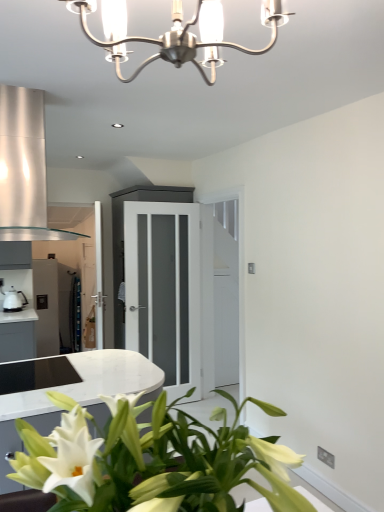
The height and width of the screenshot is (512, 384). What do you see at coordinates (152, 460) in the screenshot? I see `white glossy houseplant at lower left` at bounding box center [152, 460].

Identify the location of white glossy houseplant at lower left. The height and width of the screenshot is (512, 384). (152, 460).

What do you see at coordinates (164, 289) in the screenshot?
I see `white frosted glass door at center` at bounding box center [164, 289].

Identify the location of white glossy houseplant at lower left. The width and height of the screenshot is (384, 512). (152, 460).

From the picture: Who is bigger, white glossy kettle at left or white glossy houseplant at lower left?

With larger size is white glossy houseplant at lower left.

From the image's perspective, which is above, white glossy kettle at left or white glossy houseplant at lower left?

white glossy kettle at left, from the image's perspective.

Is the position of white glossy kettle at left less distant than that of white glossy houseplant at lower left?

No, white glossy kettle at left is further to the viewer.

Considering the relative sizes of white frosted glass door at center and white glossy kettle at left in the image provided, is white frosted glass door at center shorter than white glossy kettle at left?

No.

Considering the sizes of white frosted glass door at center and white glossy kettle at left in the image, is white frosted glass door at center wider or thinner than white glossy kettle at left?

In the image, white frosted glass door at center appears to be more narrow than white glossy kettle at left.

Considering the positions of objects white frosted glass door at center and white glossy kettle at left in the image provided, who is more to the right, white frosted glass door at center or white glossy kettle at left?

From the viewer's perspective, white frosted glass door at center appears more on the right side.

Which object is further away from the camera, white frosted glass door at center or white glossy kettle at left?

white glossy kettle at left is more distant.

Does white glossy houseplant at lower left come in front of white frosted glass door at center?

Yes, white glossy houseplant at lower left is closer to the viewer.

Is white glossy houseplant at lower left at the left side of white frosted glass door at center?

In fact, white glossy houseplant at lower left is to the right of white frosted glass door at center.

Considering the sizes of white glossy houseplant at lower left and white frosted glass door at center in the image, is white glossy houseplant at lower left wider or thinner than white frosted glass door at center?

Considering their sizes, white glossy houseplant at lower left looks broader than white frosted glass door at center.

Can you tell me how much satin silver exhaust hood at upper left and white frosted glass door at center differ in facing direction?

The angle between the facing direction of satin silver exhaust hood at upper left and the facing direction of white frosted glass door at center is 179 degrees.

Locate an element on the screen. glass door below the satin silver exhaust hood at upper left (from the image's perspective) is located at coordinates (164, 289).

Is satin silver exhaust hood at upper left situated inside white frosted glass door at center or outside?

satin silver exhaust hood at upper left is outside white frosted glass door at center.

Is white frosted glass door at center touching white glossy houseplant at lower left?

No.

From a real-world perspective, is white frosted glass door at center positioned over white glossy houseplant at lower left based on gravity?

No, from a real-world perspective, white frosted glass door at center is not on top of white glossy houseplant at lower left.

Would you say white glossy houseplant at lower left is part of white frosted glass door at center's contents?

No, white glossy houseplant at lower left is not inside white frosted glass door at center.

What's the angular difference between brushed metal chandelier at upper center and white glossy houseplant at lower left's facing directions?

There is a 1.01-degree angle between the facing directions of brushed metal chandelier at upper center and white glossy houseplant at lower left.

Which is more distant, (x=112, y=61) or (x=147, y=454)?

Positioned behind is point (x=112, y=61).

From the image's perspective, between brushed metal chandelier at upper center and white glossy houseplant at lower left, which one is located above?

brushed metal chandelier at upper center, from the image's perspective.

Is satin silver exhaust hood at upper left far away from white glossy kettle at left?

Absolutely, satin silver exhaust hood at upper left is distant from white glossy kettle at left.

Consider the image. Is the position of satin silver exhaust hood at upper left more distant than that of white glossy kettle at left?

That is False.

Between satin silver exhaust hood at upper left and white glossy kettle at left, which one has larger width?

With larger width is satin silver exhaust hood at upper left.

Is satin silver exhaust hood at upper left bigger than white glossy kettle at left?

Yes, satin silver exhaust hood at upper left is bigger than white glossy kettle at left.

What are the coordinates of `appliance on the left of white glossy houseplant at lower left` in the screenshot? It's located at (13, 300).

The image size is (384, 512). Find the location of `glass door beneath the white glossy kettle at left (from a real-world perspective)`. glass door beneath the white glossy kettle at left (from a real-world perspective) is located at coordinates (164, 289).

When comparing their distances from satin silver exhaust hood at upper left, does white glossy houseplant at lower left or brushed metal chandelier at upper center seem closer?

brushed metal chandelier at upper center is closer to satin silver exhaust hood at upper left.

When comparing their distances from brushed metal chandelier at upper center, does white glossy kettle at left or white frosted glass door at center seem further?

white glossy kettle at left.

Based on their spatial positions, is white glossy houseplant at lower left or satin silver exhaust hood at upper left closer to white frosted glass door at center?

Among the two, satin silver exhaust hood at upper left is located nearer to white frosted glass door at center.

Considering their positions, is satin silver exhaust hood at upper left positioned closer to white frosted glass door at center than white glossy kettle at left?

white glossy kettle at left is positioned closer to the anchor white frosted glass door at center.

Based on their spatial positions, is brushed metal chandelier at upper center or white glossy kettle at left further from white glossy houseplant at lower left?

white glossy kettle at left lies further to white glossy houseplant at lower left than the other object.

Looking at the image, which one is located further to satin silver exhaust hood at upper left, white glossy kettle at left or white glossy houseplant at lower left?

white glossy kettle at left lies further to satin silver exhaust hood at upper left than the other object.

When comparing their distances from brushed metal chandelier at upper center, does white frosted glass door at center or satin silver exhaust hood at upper left seem further?

white frosted glass door at center is positioned further to the anchor brushed metal chandelier at upper center.

Based on their spatial positions, is white glossy houseplant at lower left or brushed metal chandelier at upper center further from white glossy kettle at left?

brushed metal chandelier at upper center is further to white glossy kettle at left.

This screenshot has height=512, width=384. What are the coordinates of `exhaust hood between white glossy houseplant at lower left and white glossy kettle at left in the front-back direction` in the screenshot? It's located at (24, 168).

Where is `lamp between white glossy houseplant at lower left and white glossy kettle at left from front to back`? lamp between white glossy houseplant at lower left and white glossy kettle at left from front to back is located at coordinates (175, 34).

You are a GUI agent. You are given a task and a screenshot of the screen. Output one action in this format:
    pyautogui.click(x=<x>, y=<y>)
    Task: Click on the glass door located between brushed metal chandelier at upper center and white glossy kettle at left in the depth direction
    The height and width of the screenshot is (512, 384).
    Given the screenshot: What is the action you would take?
    pyautogui.click(x=164, y=289)

The image size is (384, 512). Find the location of `lamp between white glossy houseplant at lower left and satin silver exhaust hood at upper left in the front-back direction`. lamp between white glossy houseplant at lower left and satin silver exhaust hood at upper left in the front-back direction is located at coordinates (175, 34).